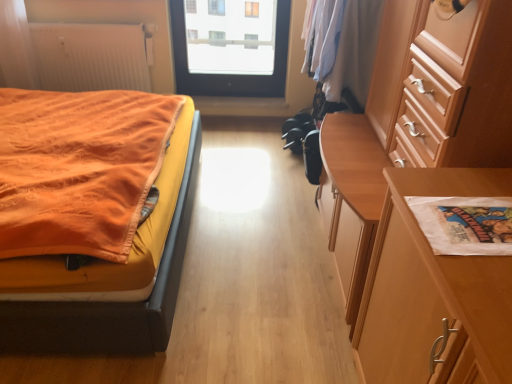
Question: Is white ribbed radiator at upper left located outside white paper at right?

Choices:
 (A) yes
 (B) no

Answer: (A)

Question: Considering the relative sizes of white ribbed radiator at upper left and white paper at right in the image provided, is white ribbed radiator at upper left shorter than white paper at right?

Choices:
 (A) yes
 (B) no

Answer: (B)

Question: Does white ribbed radiator at upper left have a greater width compared to white paper at right?

Choices:
 (A) yes
 (B) no

Answer: (B)

Question: Does white ribbed radiator at upper left touch white paper at right?

Choices:
 (A) no
 (B) yes

Answer: (A)

Question: Is white ribbed radiator at upper left aimed at white paper at right?

Choices:
 (A) yes
 (B) no

Answer: (A)

Question: Is white paper at right completely or partially inside white ribbed radiator at upper left?

Choices:
 (A) yes
 (B) no

Answer: (B)

Question: Is transparent glass door at upper center further to camera compared to white paper bag at right?

Choices:
 (A) yes
 (B) no

Answer: (A)

Question: Can white paper bag at right be found inside transparent glass door at upper center?

Choices:
 (A) no
 (B) yes

Answer: (A)

Question: Is transparent glass door at upper center positioned before white paper bag at right?

Choices:
 (A) yes
 (B) no

Answer: (B)

Question: Is transparent glass door at upper center to the right of white paper bag at right from the viewer's perspective?

Choices:
 (A) no
 (B) yes

Answer: (A)

Question: From a real-world perspective, is transparent glass door at upper center located higher than white paper bag at right?

Choices:
 (A) yes
 (B) no

Answer: (A)

Question: Would you consider transparent glass door at upper center to be distant from white paper bag at right?

Choices:
 (A) yes
 (B) no

Answer: (A)

Question: Could you tell me if orange fabric bed at left is turned towards white ribbed radiator at upper left?

Choices:
 (A) yes
 (B) no

Answer: (B)